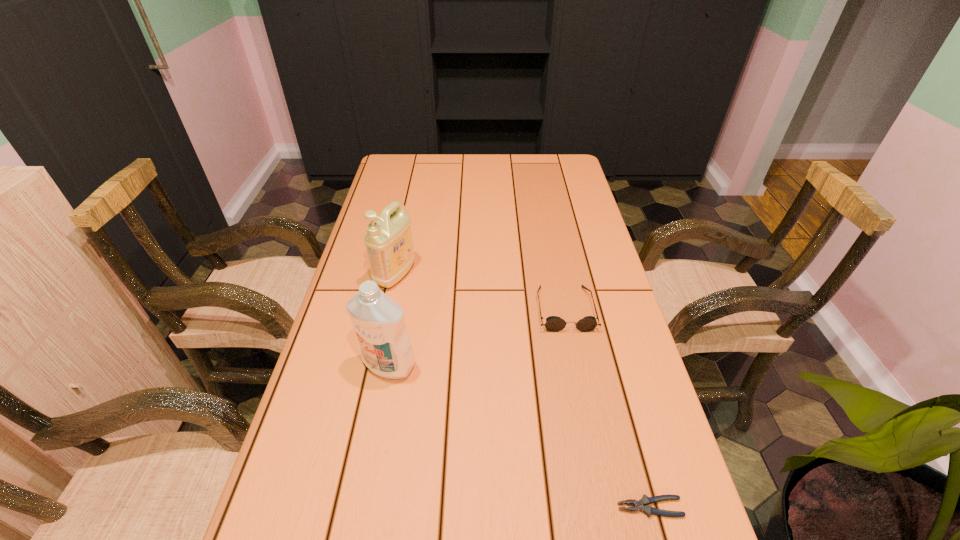
Identify the location of the nearer detergent. (378, 321).

Find the location of `the farther detergent`. the farther detergent is located at coordinates (389, 244).

Locate an element on the screen. sunglasses is located at coordinates (553, 323).

Identify the location of the nearest object. (641, 505).

Where is `the shortest object`? the shortest object is located at coordinates (641, 505).

You are a GUI agent. You are given a task and a screenshot of the screen. Output one action in this format:
    pyautogui.click(x=<x>, y=<y>)
    Task: Click on the vacant region located on the right of the nearer detergent
    
    Given the screenshot: What is the action you would take?
    pyautogui.click(x=588, y=365)

The height and width of the screenshot is (540, 960). What are the coordinates of `vacant area situated 0.210m on the right of the farther detergent` in the screenshot? It's located at (489, 275).

Locate an element on the screen. blank area located on the front-facing side of the sunglasses is located at coordinates (589, 434).

Locate an element on the screen. This screenshot has height=540, width=960. free spot located at the gripping part of the pliers is located at coordinates (495, 507).

Where is `free space located 0.080m at the gripping part of the pliers`? This screenshot has height=540, width=960. free space located 0.080m at the gripping part of the pliers is located at coordinates (573, 507).